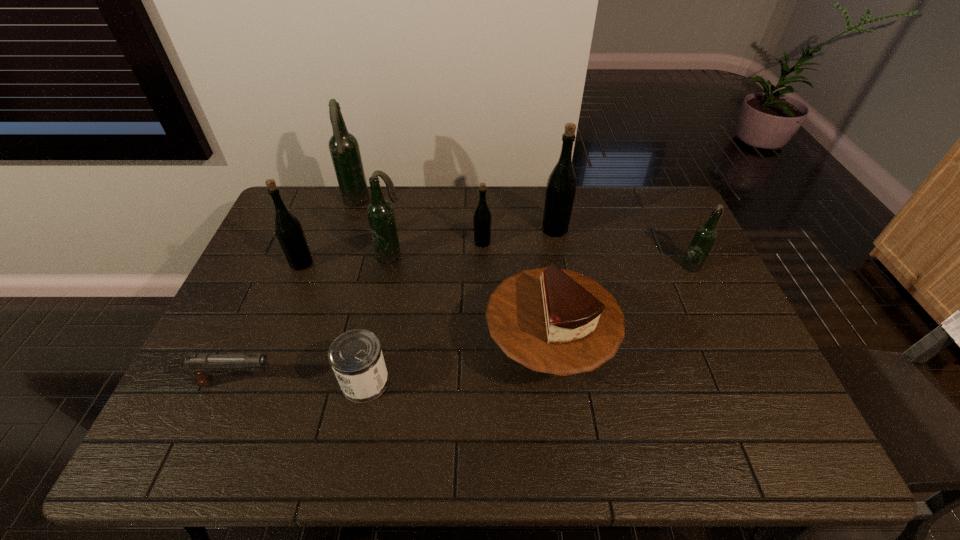
Identify the location of vacant space located 0.190m on the front of the smallest dark beer bottle. (720, 322).

Find the location of `blank space located on the left of the cake`. blank space located on the left of the cake is located at coordinates 393,346.

This screenshot has width=960, height=540. I want to click on vacant position located 0.150m on the back of the can, so click(378, 315).

In order to click on vacant space situated 0.240m in the direction the gray gun is aimed in this screenshot , I will do `click(378, 383)`.

What are the coordinates of `beer bottle present at the left edge` in the screenshot? It's located at (288, 229).

This screenshot has height=540, width=960. I want to click on gun positioned at the left edge, so click(x=202, y=366).

What are the coordinates of `object present at the right edge` in the screenshot? It's located at (705, 236).

Find the location of a particular element. This screenshot has width=960, height=540. vacant space at the far edge is located at coordinates (x=334, y=221).

Where is `vacant area at the near edge of the desktop`? vacant area at the near edge of the desktop is located at coordinates (517, 454).

The image size is (960, 540). Find the location of `free space at the right edge`. free space at the right edge is located at coordinates (712, 391).